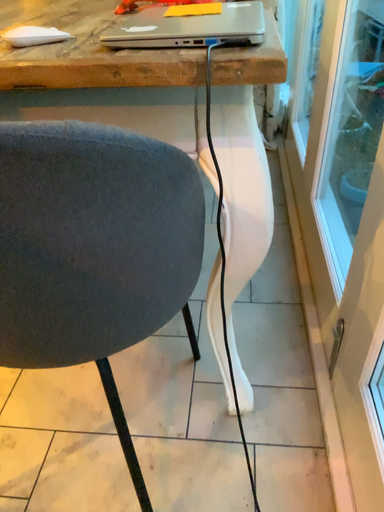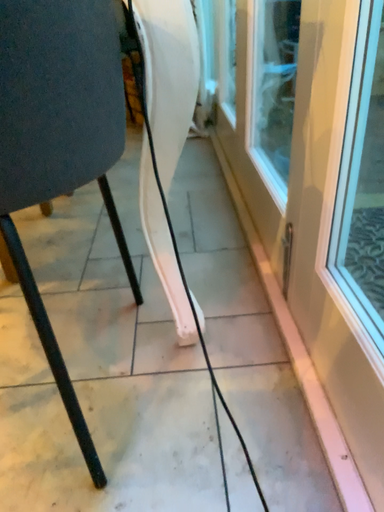
Question: Which way did the camera rotate in the video?

Choices:
 (A) rotated left
 (B) rotated right

Answer: (B)